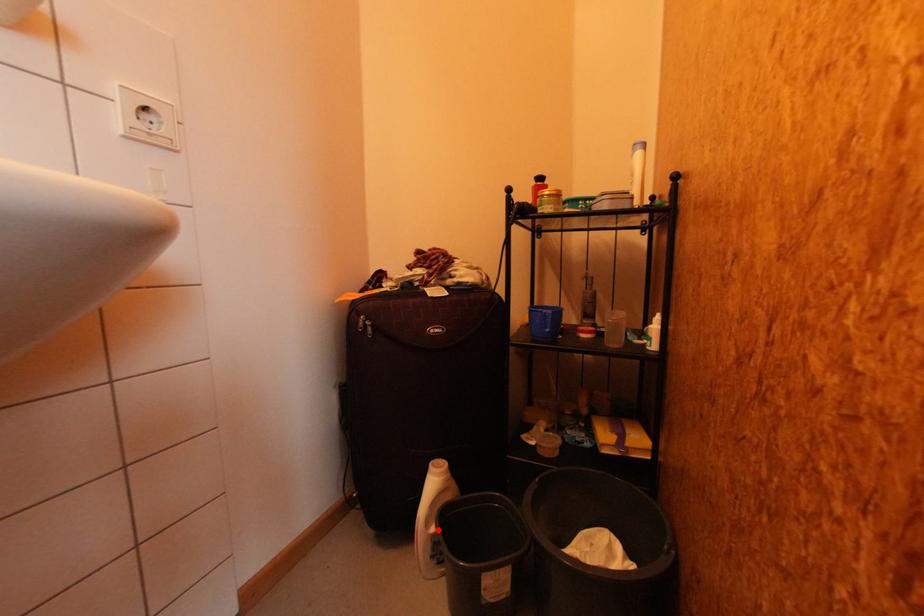
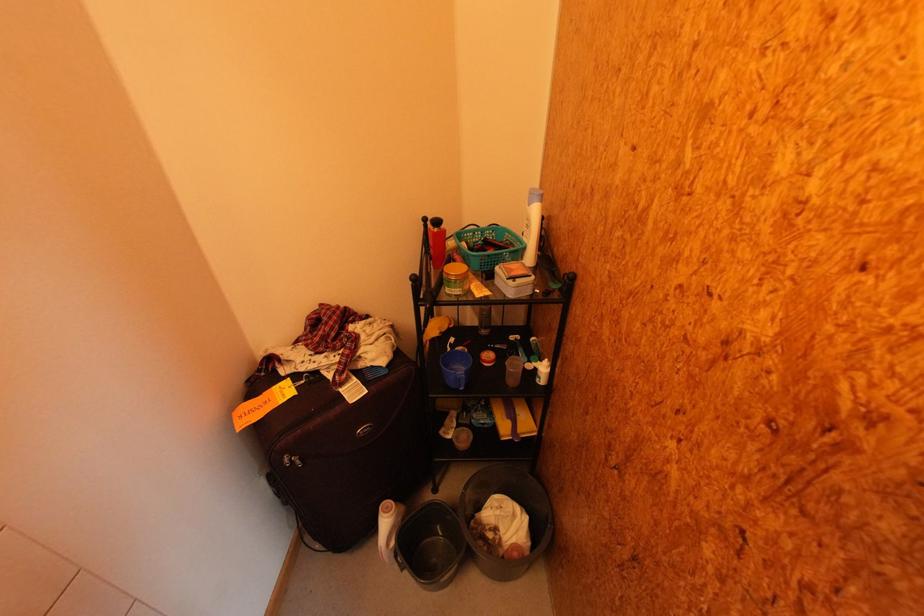
In the second image, find the point that corresponds to the highlighted location in the first image.

(397, 545)